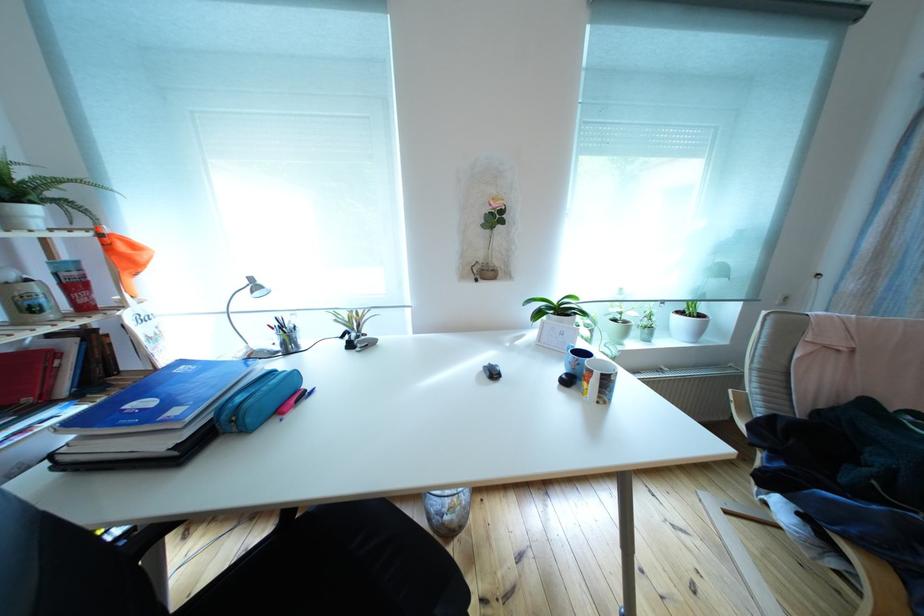
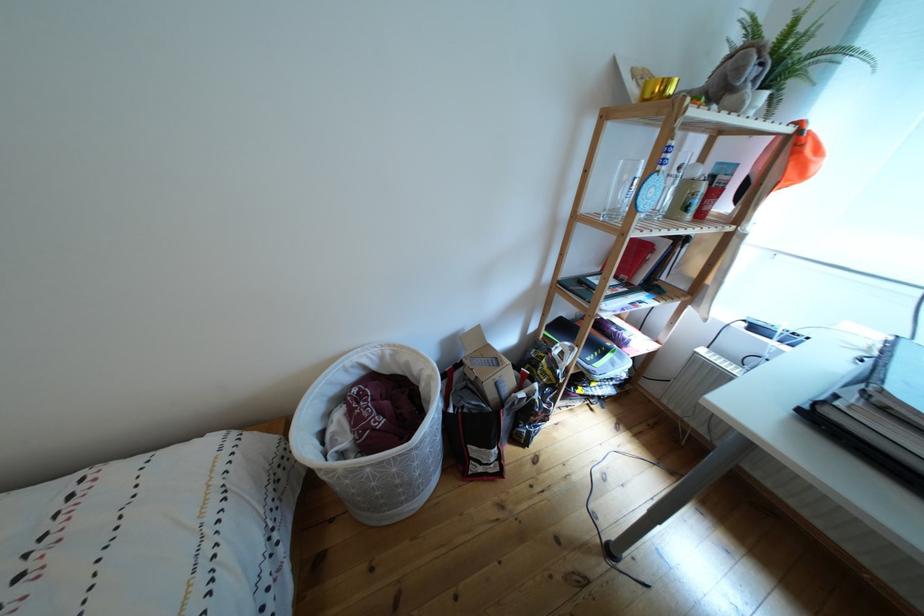
Based on the continuous images, in which direction is the camera rotating?

The camera's rotation is toward left-down.